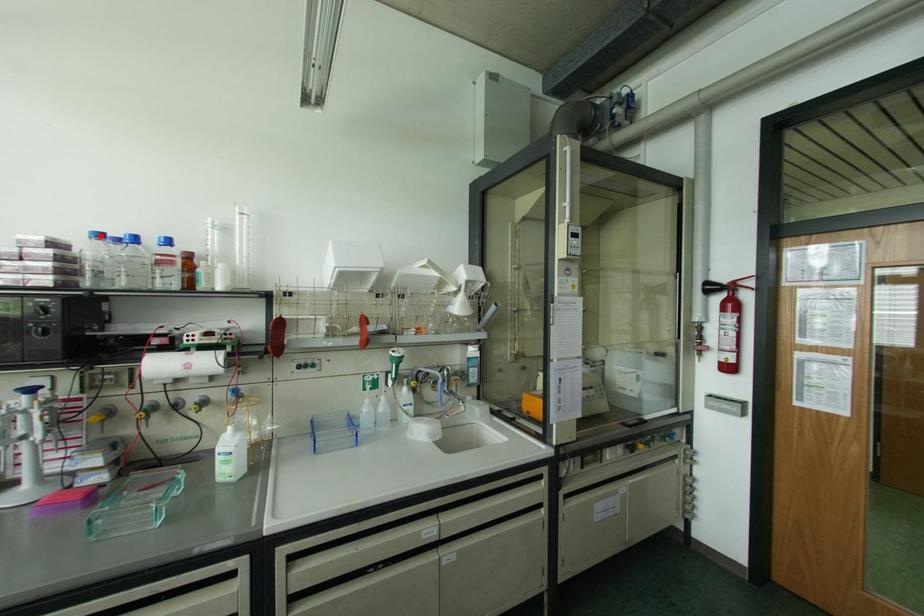
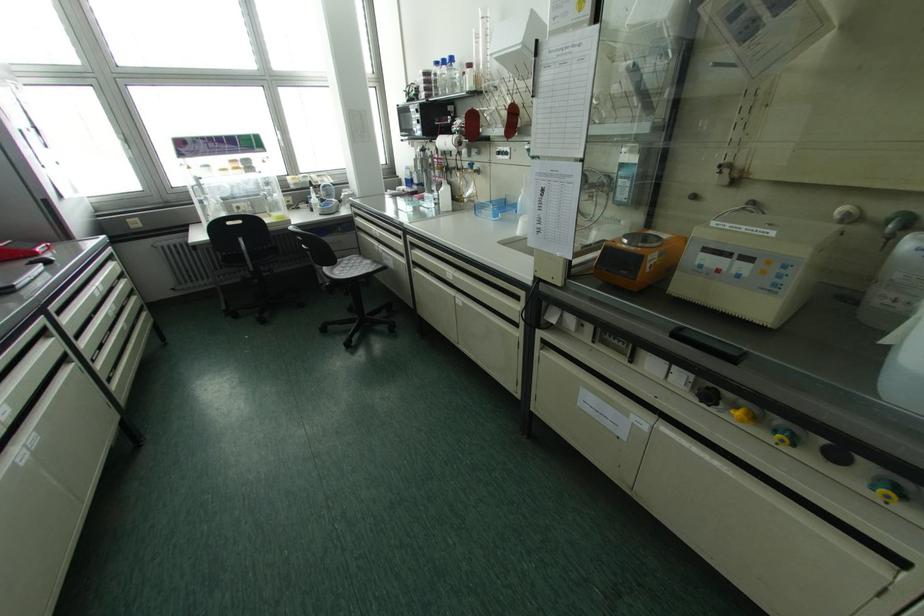
The point at the highlighted location is marked in the first image. Where is the corresponding point in the second image?

(435, 63)